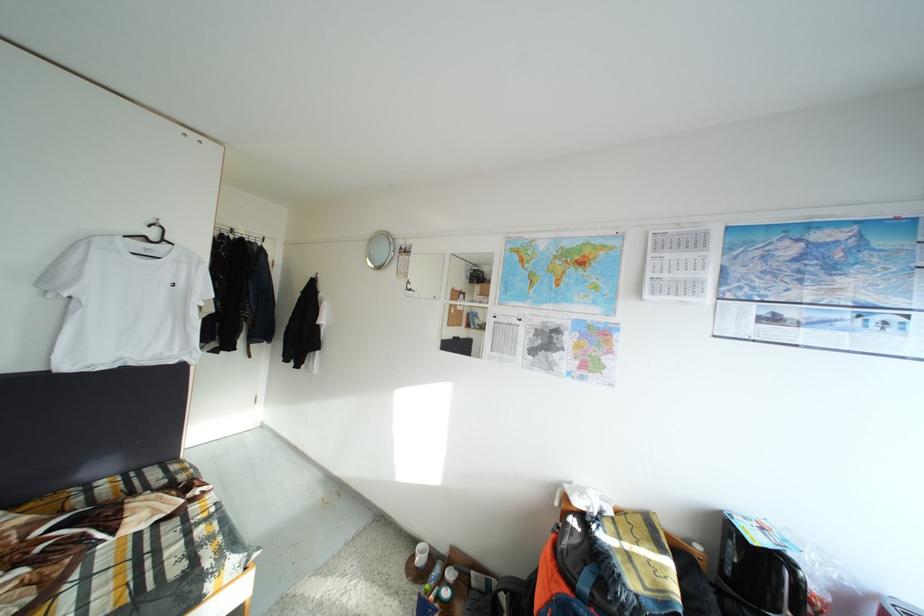
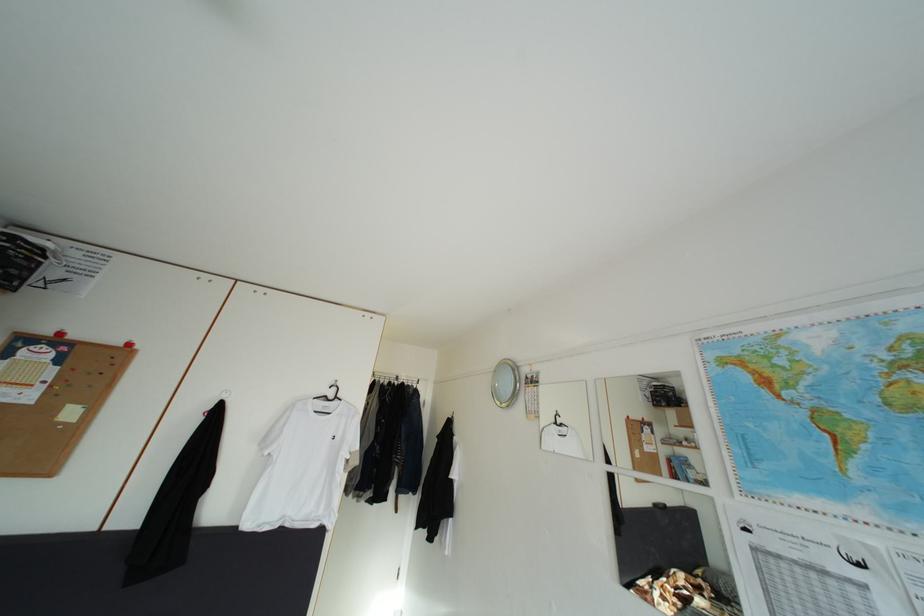
Find the pixel in the second image that matches point (162, 240) in the first image.

(339, 400)